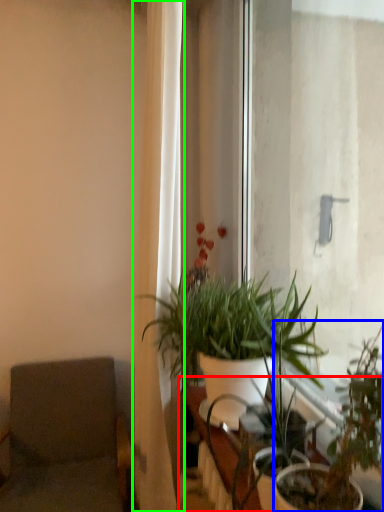
Question: Based on their relative distances, which object is farther from table (highlighted by a red box)? Choose from houseplant (highlighted by a blue box) and curtain (highlighted by a green box).

Choices:
 (A) houseplant
 (B) curtain

Answer: (B)